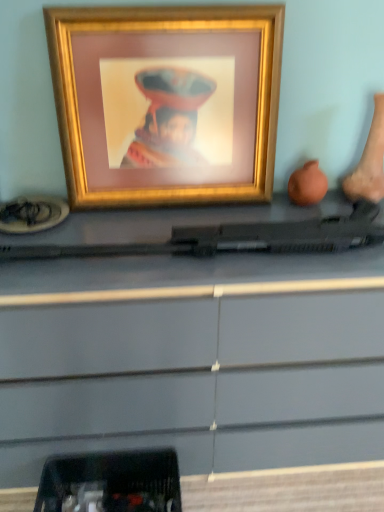
Question: Does gold metallic picture frame at upper center have a smaller size compared to matte black gun at center?

Choices:
 (A) no
 (B) yes

Answer: (B)

Question: Is matte black gun at center a part of gold metallic picture frame at upper center?

Choices:
 (A) no
 (B) yes

Answer: (A)

Question: Does gold metallic picture frame at upper center appear on the left side of matte black gun at center?

Choices:
 (A) no
 (B) yes

Answer: (B)

Question: From the image's perspective, does gold metallic picture frame at upper center appear higher than matte black gun at center?

Choices:
 (A) no
 (B) yes

Answer: (B)

Question: From a real-world perspective, is gold metallic picture frame at upper center below matte black gun at center?

Choices:
 (A) no
 (B) yes

Answer: (A)

Question: Is gold metallic picture frame at upper center shorter than matte black gun at center?

Choices:
 (A) no
 (B) yes

Answer: (B)

Question: From the image's perspective, is gold metallic picture frame at upper center on top of black plastic tray at lower left?

Choices:
 (A) yes
 (B) no

Answer: (A)

Question: Does gold metallic picture frame at upper center turn towards black plastic tray at lower left?

Choices:
 (A) no
 (B) yes

Answer: (A)

Question: From a real-world perspective, is gold metallic picture frame at upper center located higher than black plastic tray at lower left?

Choices:
 (A) no
 (B) yes

Answer: (B)

Question: Does gold metallic picture frame at upper center have a lesser height compared to black plastic tray at lower left?

Choices:
 (A) no
 (B) yes

Answer: (A)

Question: Can you confirm if gold metallic picture frame at upper center is smaller than black plastic tray at lower left?

Choices:
 (A) no
 (B) yes

Answer: (A)

Question: Can we say gold metallic picture frame at upper center lies outside black plastic tray at lower left?

Choices:
 (A) no
 (B) yes

Answer: (B)

Question: Does black plastic tray at lower left have a lesser width compared to matte black gun at center?

Choices:
 (A) no
 (B) yes

Answer: (B)